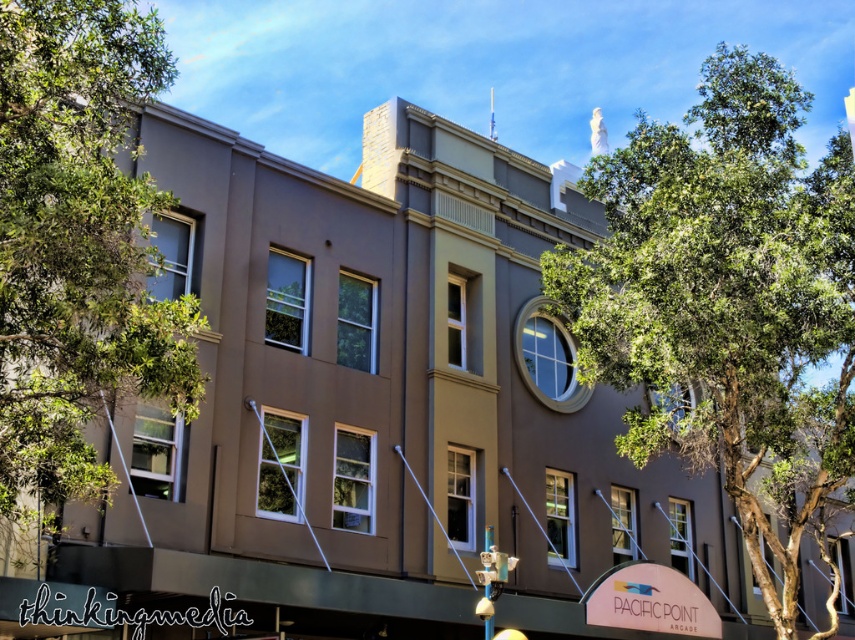
Between green leafy tree at upper right and green leafy tree at left, which one is positioned lower?

green leafy tree at left

From the picture: Which of these two, green leafy tree at upper right or green leafy tree at left, stands taller?

green leafy tree at upper right is taller.

This screenshot has width=855, height=640. What are the coordinates of `green leafy tree at upper right` in the screenshot? It's located at (726, 301).

Locate an element on the screen. Image resolution: width=855 pixels, height=640 pixels. green leafy tree at upper right is located at coordinates (726, 301).